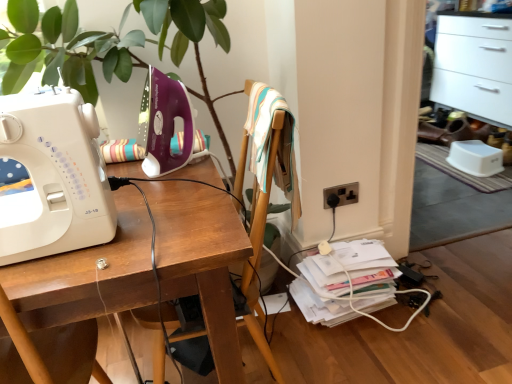
The height and width of the screenshot is (384, 512). Identify the location of vacant area that is in front of purple plastic sewing machine at upper left, placed as the second sewing machine when sorted from front to back. (169, 183).